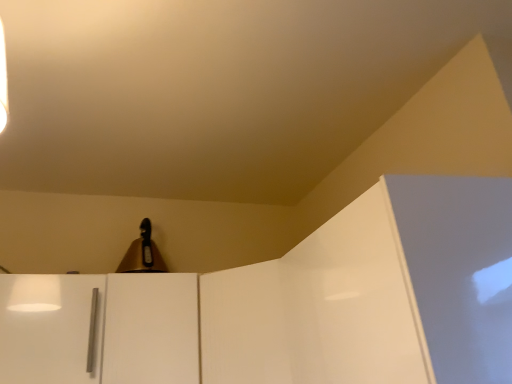
Question: Visually, is gold metallic bell at upper center positioned to the left or to the right of white matte cabinet handle at lower left?

Choices:
 (A) left
 (B) right

Answer: (B)

Question: From a real-world perspective, is gold metallic bell at upper center positioned above or below white matte cabinet handle at lower left?

Choices:
 (A) below
 (B) above

Answer: (B)

Question: Which object is the farthest from the gold metallic bell at upper center?

Choices:
 (A) white matte cabinet handle at lower left
 (B) white glossy door at center

Answer: (A)

Question: Which is nearer to the gold metallic bell at upper center?

Choices:
 (A) white matte cabinet handle at lower left
 (B) white glossy door at center

Answer: (B)